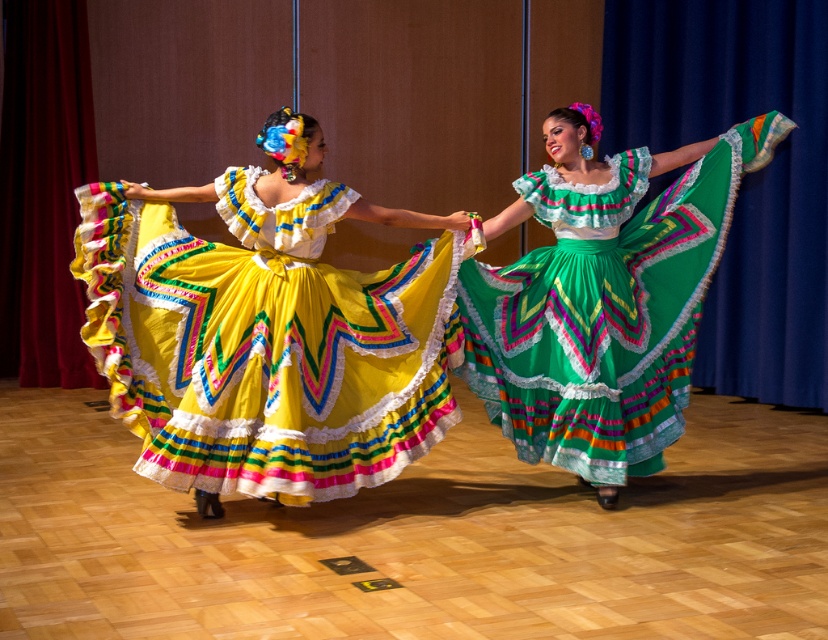
Which is below, matte yellow dress at center or green satin skirt at center?

matte yellow dress at center is lower down.

Does matte yellow dress at center appear on the left side of green satin skirt at center?

Yes, matte yellow dress at center is to the left of green satin skirt at center.

Is point (92, 253) closer to viewer compared to point (639, 387)?

Yes, it is.

The height and width of the screenshot is (640, 828). Find the location of `matte yellow dress at center`. matte yellow dress at center is located at coordinates (268, 330).